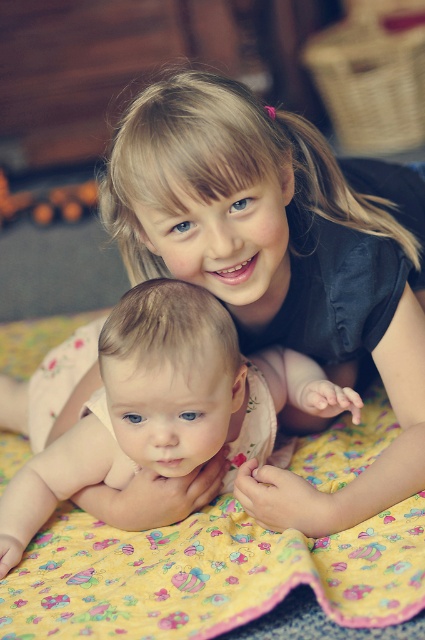
You are a photographer setting up for a family photo. You see the yellow floral fabric at center and the smooth beige baby at center. Which object is located to the right of the other?

The yellow floral fabric at center is positioned on the right side of smooth beige baby at center.

You are a photographer setting up for a family photo. You have to ensure that the yellow floral fabric at center and the smooth beige baby at center are positioned so that there is at least 8 inches of space between them for lighting equipment. Based on the image description, will you need to adjust their current positions?

The yellow floral fabric at center is currently 7.46 inches from the smooth beige baby at center, which is less than the required 8 inches. Therefore, you will need to adjust their positions to create more space between them.

You are a photographer setting up for a family photo. You need to ensure that the yellow floral fabric at center and the smooth beige baby at center are both visible in the frame. Given their positions, which object should you focus on first to ensure both are in focus?

The yellow floral fabric at center is shorter than the smooth beige baby at center, so you should focus on the smooth beige baby at center first to ensure both are in focus.